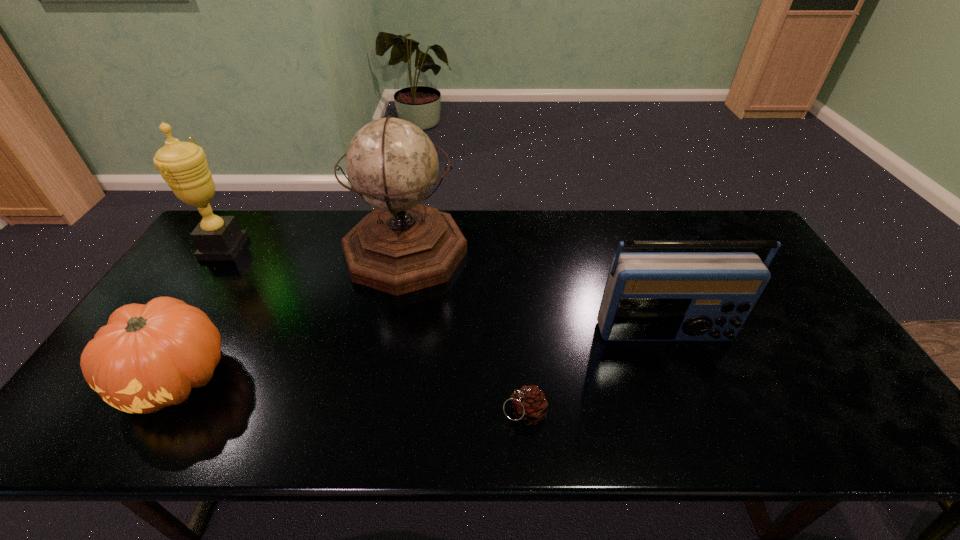
This screenshot has width=960, height=540. Find the location of `object that is at the near left corner`. object that is at the near left corner is located at coordinates (147, 357).

Find the location of `vacant region at the far edge of the desktop`. vacant region at the far edge of the desktop is located at coordinates (540, 235).

In the image, there is a desktop. Identify the location of free space at the near edge. (230, 419).

Where is `free space at the left edge`? The height and width of the screenshot is (540, 960). free space at the left edge is located at coordinates (193, 278).

You are a GUI agent. You are given a task and a screenshot of the screen. Output one action in this format:
    pyautogui.click(x=<x>, y=<y>)
    Task: Click on the free space at the right edge
    This screenshot has width=960, height=540.
    Given the screenshot: What is the action you would take?
    pyautogui.click(x=822, y=350)

In the image, there is a desktop. At what (x,y) coordinates should I click in order to perform the action: click on vacant space at the far left corner. Please return your answer as a coordinate pair (x, y). The height and width of the screenshot is (540, 960). Looking at the image, I should click on (246, 225).

In the image, there is a desktop. Identify the location of vacant space at the near left corner. The height and width of the screenshot is (540, 960). (75, 441).

In the image, there is a desktop. Identify the location of blank space at the far right corner. (738, 234).

Identify the location of unoccupied area between the shortest object and the rightmost object. This screenshot has width=960, height=540. (594, 373).

This screenshot has height=540, width=960. I want to click on free space between the globe and the trophy cup, so click(x=315, y=250).